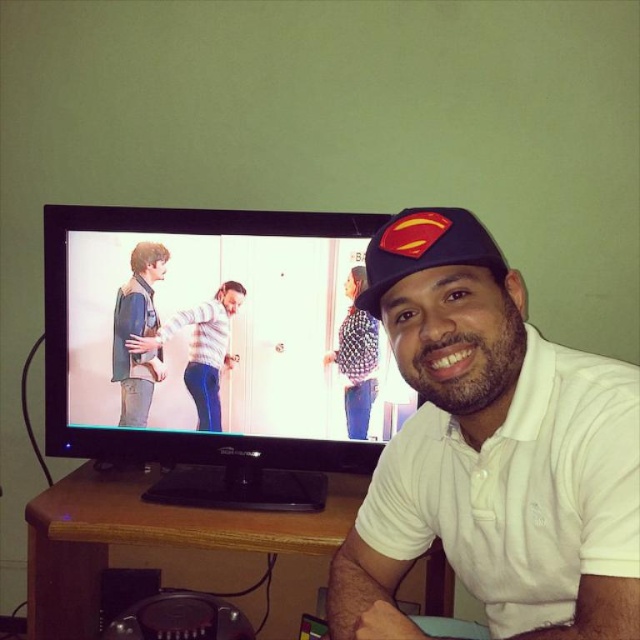
Question: Is wooden table at lower center above black matte baseball cap at center?

Choices:
 (A) no
 (B) yes

Answer: (A)

Question: Which point is farther to the camera?

Choices:
 (A) (349, 298)
 (B) (129, 356)
 (C) (202, 416)
 (D) (385, 284)

Answer: (B)

Question: Considering the relative positions of denim jacket at left and striped sweater at center in the image provided, where is denim jacket at left located with respect to striped sweater at center?

Choices:
 (A) above
 (B) below

Answer: (A)

Question: Which of the following is the farthest from the observer?

Choices:
 (A) striped sweater at center
 (B) denim jacket at left

Answer: (B)

Question: Can you confirm if wooden table at lower center is bigger than patterned fabric shirt at center?

Choices:
 (A) yes
 (B) no

Answer: (A)

Question: Which point is farther to the camera?

Choices:
 (A) patterned fabric shirt at center
 (B) wooden table at lower center
 (C) denim jacket at left
 (D) white cotton polo shirt at center

Answer: (C)